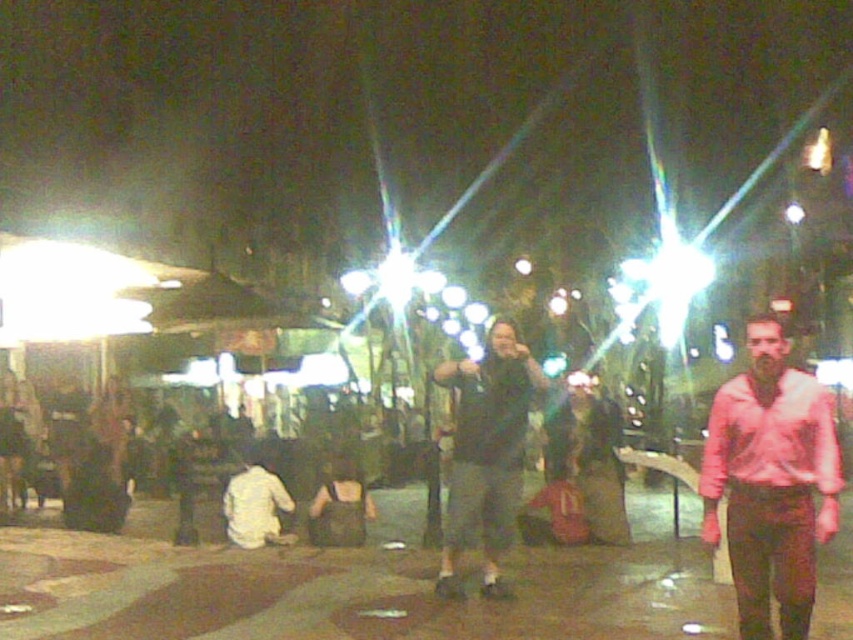
Is the position of pink cotton shirt at right less distant than that of dark gray fabric jacket at center?

That is True.

Locate an element on the screen. pink cotton shirt at right is located at coordinates (770, 483).